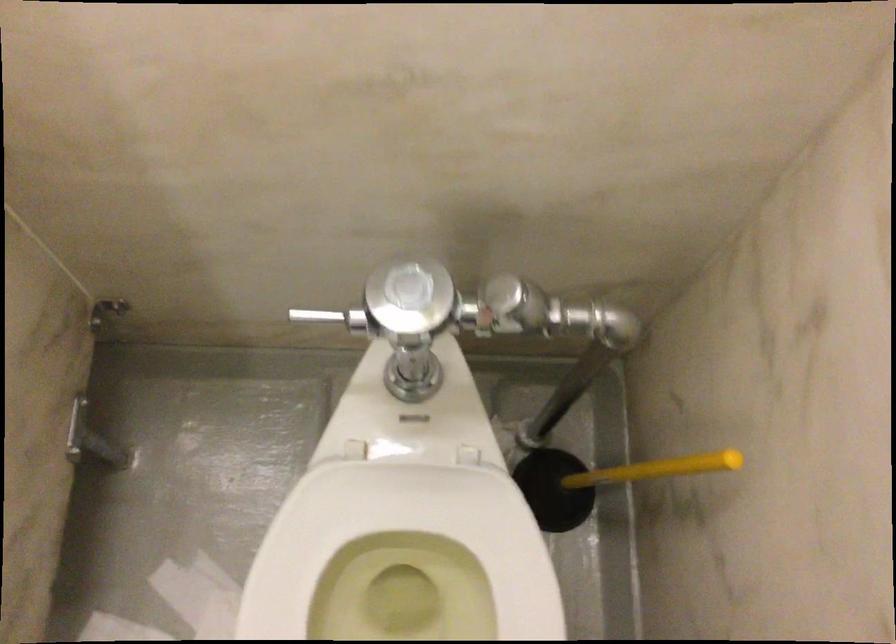
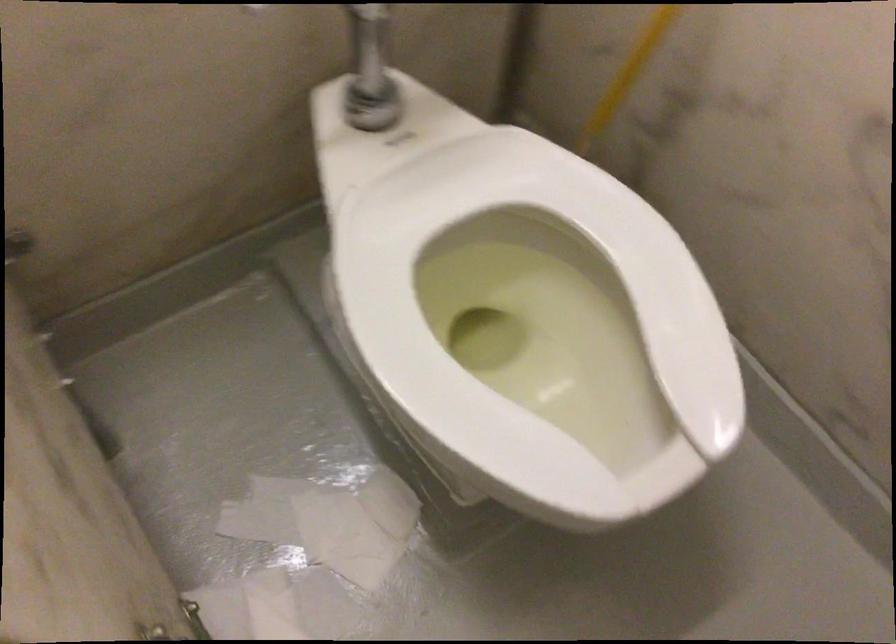
In the second image, find the point that corresponds to pixel 476 560 in the first image.

(536, 254)